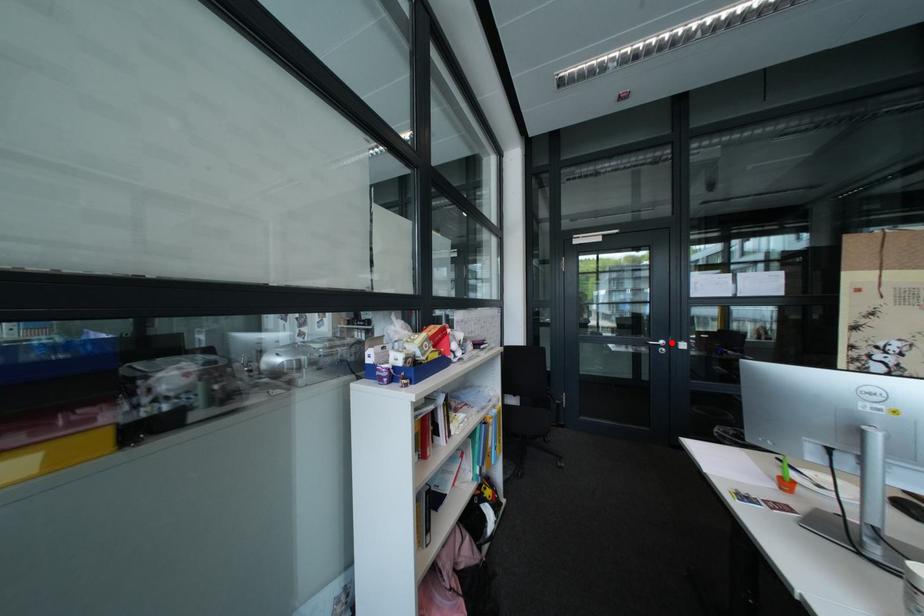
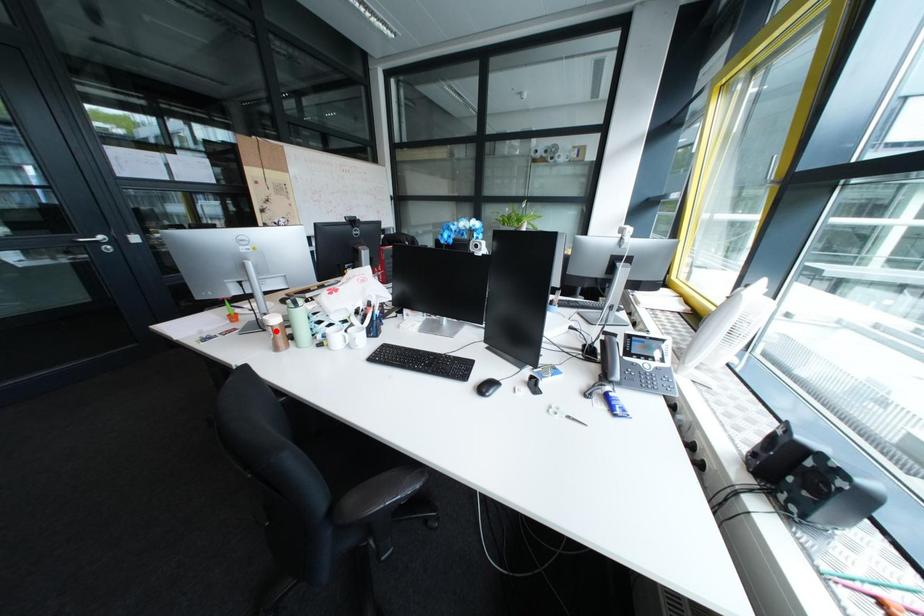
I am providing you with two images of the same scene from different viewpoints. A red point is marked on the first image and another point is marked on the second image. Are the points marked in image1 and image2 representing the same 3D position?

No